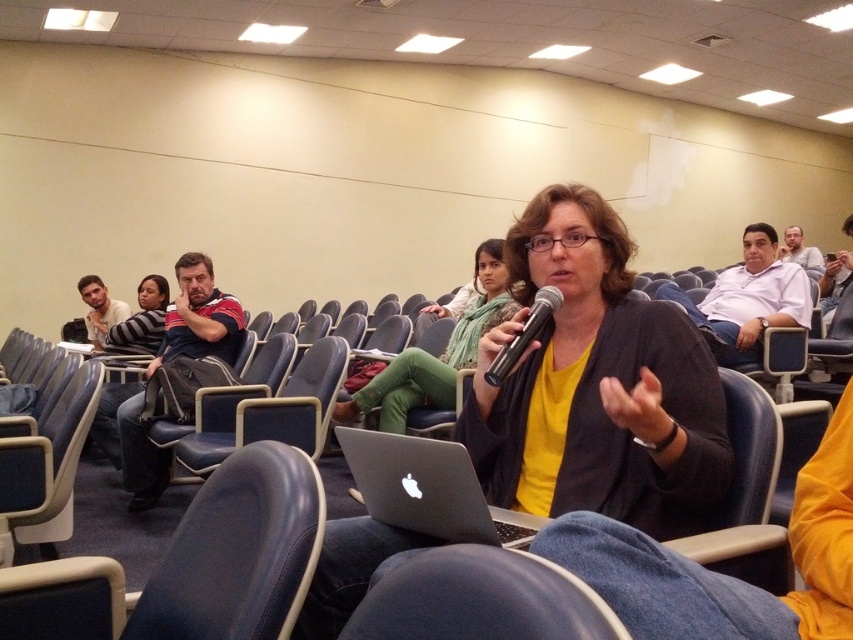
You are organizing a workshop and need to place a 12 cm wide notebook on the silver metallic laptop at center. Can the notebook fit on the laptop based on the laptop and the matte white shirt at upper right?

The silver metallic laptop at center has a width less than the matte white shirt at upper right. Since the notebook is 12 cm wide, but we don not know the exact width of the laptop, we cannot determine if it will fit. More information is needed.

You are attending a lecture in the lecture hall and notice the silver metallic laptop at center and the matte white shirt at upper right. Which object is closer to the front of the room?

The silver metallic laptop at center is positioned under the matte white shirt at upper right, meaning it is closer to the front of the room.